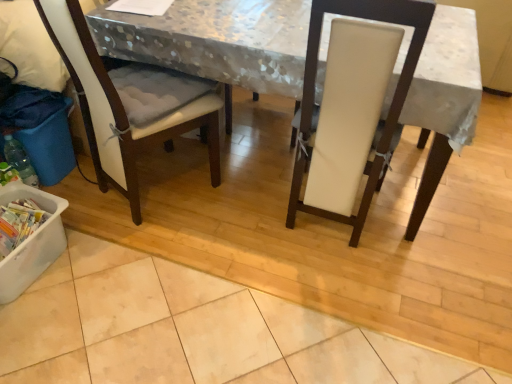
You are a GUI agent. You are given a task and a screenshot of the screen. Output one action in this format:
    pyautogui.click(x=<x>, y=<y>)
    Task: Click on the free area in between white leather chair at center, the second chair when ordered from left to right, and white fabric-covered table at center
    
    Given the screenshot: What is the action you would take?
    pyautogui.click(x=296, y=236)